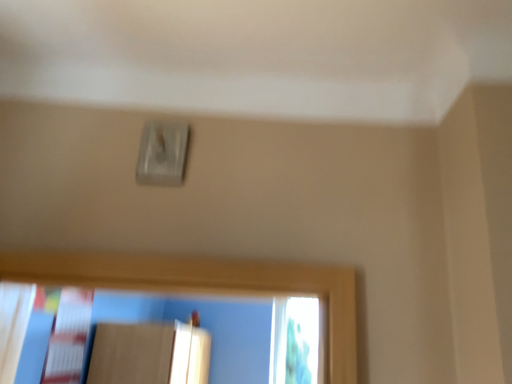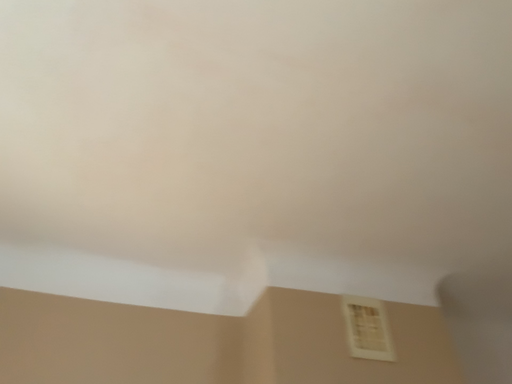
Question: Which way did the camera rotate in the video?

Choices:
 (A) rotated downward
 (B) rotated upward

Answer: (B)